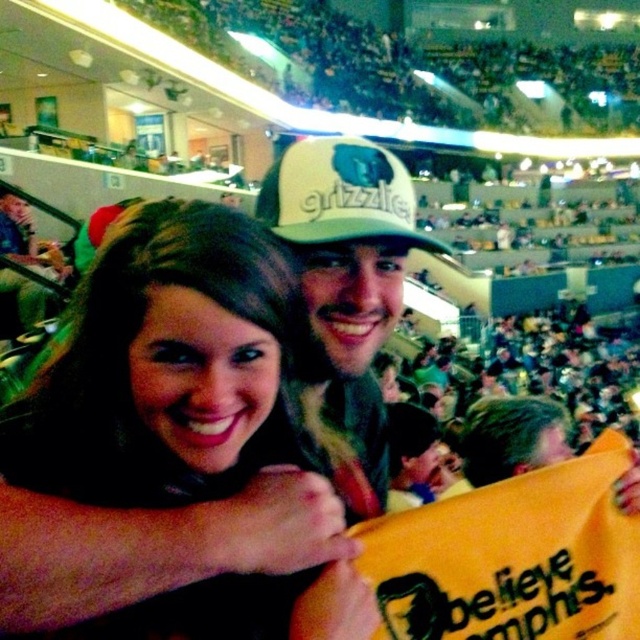
Between smooth brown hair at center and white textured cap at center, which one has more height?

white textured cap at center

Is smooth brown hair at center taller than white textured cap at center?

No, smooth brown hair at center is not taller than white textured cap at center.

You are a GUI agent. You are given a task and a screenshot of the screen. Output one action in this format:
    pyautogui.click(x=<x>, y=<y>)
    Task: Click on the smooth brown hair at center
    The height and width of the screenshot is (640, 640).
    Given the screenshot: What is the action you would take?
    pyautogui.click(x=170, y=369)

Is white matte baseball cap at center to the right of white textured cap at center from the viewer's perspective?

Incorrect, white matte baseball cap at center is not on the right side of white textured cap at center.

Which of these two, white matte baseball cap at center or white textured cap at center, stands taller?

Standing taller between the two is white matte baseball cap at center.

Does point (262, 220) come behind point (502, 440)?

No, (262, 220) is in front of (502, 440).

Where is `white matte baseball cap at center`? white matte baseball cap at center is located at coordinates (340, 195).

Who is more forward, [124,454] or [307,218]?

Point [124,454]

Is point (3, 468) closer to camera compared to point (294, 173)?

Yes, point (3, 468) is closer to viewer.

Is point (237, 433) closer to camera compared to point (376, 177)?

Yes, it is.

The height and width of the screenshot is (640, 640). In order to click on smooth brown hair at center in this screenshot , I will do `click(170, 369)`.